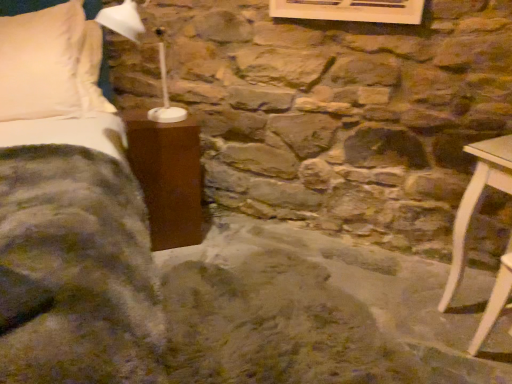
Identify the location of free area behind white wood chair at lower right, marked as the 1th furniture in a bottom-to-top arrangement. This screenshot has width=512, height=384. (471, 322).